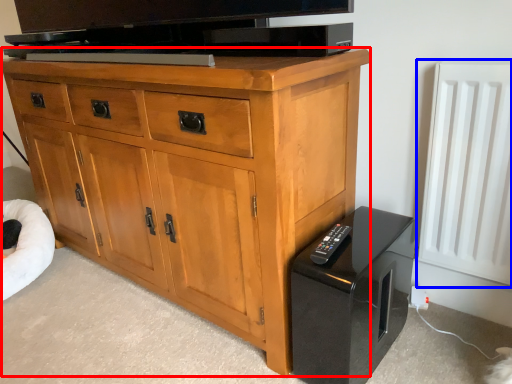
Question: Among these objects, which one is nearest to the camera, chest of drawers (highlighted by a red box) or radiator (highlighted by a blue box)?

Choices:
 (A) chest of drawers
 (B) radiator

Answer: (A)